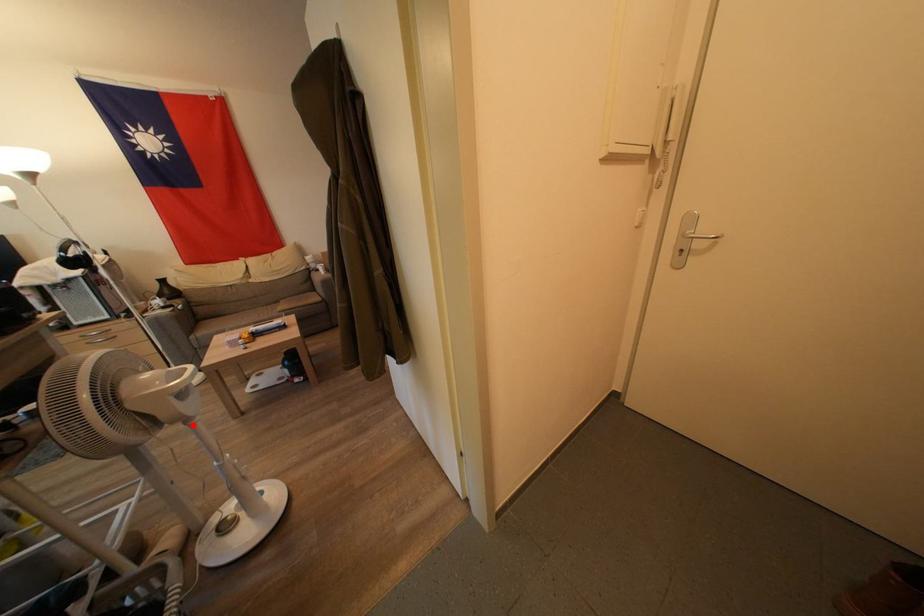
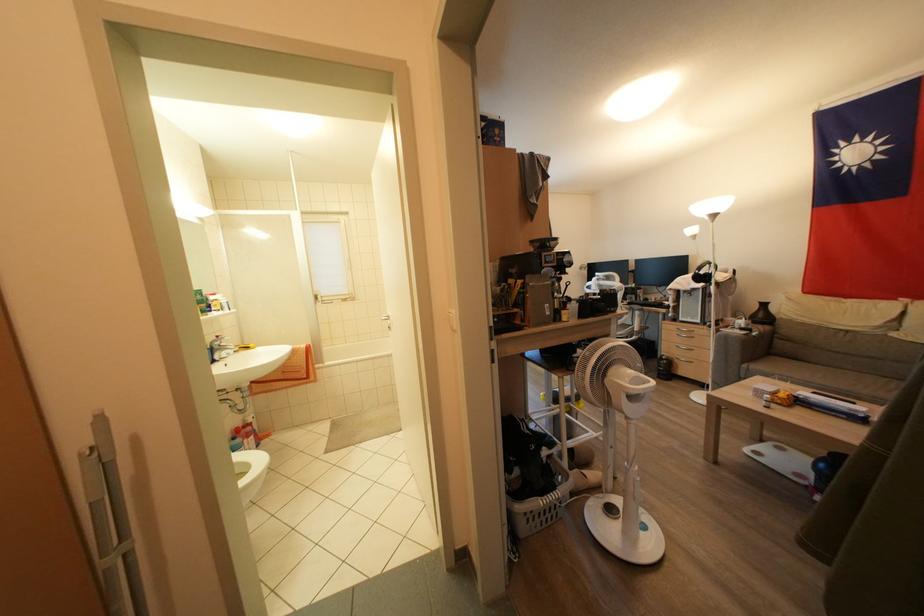
Locate, in the second image, the point that corresponds to the highlighted location in the first image.

(631, 421)